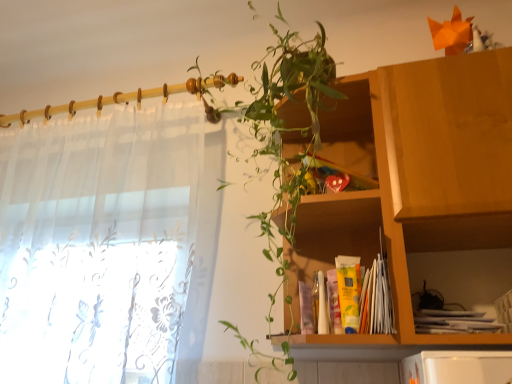
Question: Considering the positions of point (359, 74) and point (79, 117), is point (359, 74) closer or farther from the camera than point (79, 117)?

Choices:
 (A) closer
 (B) farther

Answer: (A)

Question: Choose the correct answer: Is wooden cabinet at upper right inside sheer white curtain at left or outside it?

Choices:
 (A) outside
 (B) inside

Answer: (A)

Question: Estimate the real-world distances between objects in this image. Which object is farther from the sheer white curtain at left?

Choices:
 (A) wooden cabinet at upper right
 (B) wooden cabinet at center
 (C) green leafy plant at upper center

Answer: (B)

Question: Estimate the real-world distances between objects in this image. Which object is closer to the green leafy plant at upper center?

Choices:
 (A) sheer white curtain at left
 (B) wooden cabinet at upper right
 (C) wooden cabinet at center

Answer: (B)